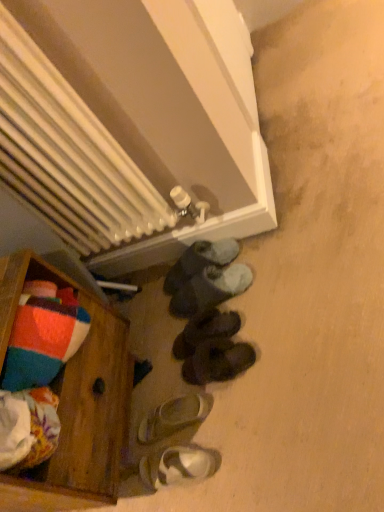
This screenshot has width=384, height=512. I want to click on vacant space to the right of black suede shoes at lower center, which is the 3th footwear from bottom to top, so click(262, 330).